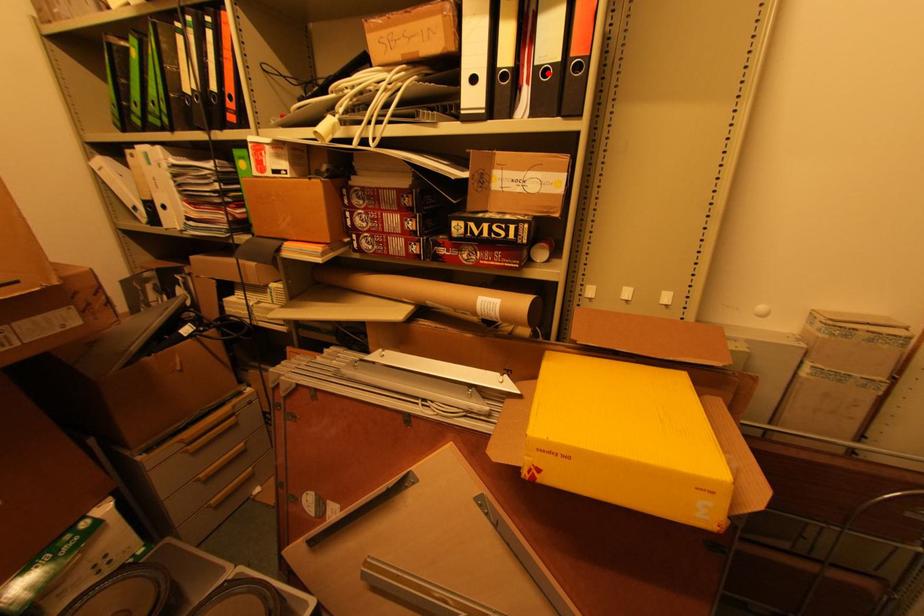
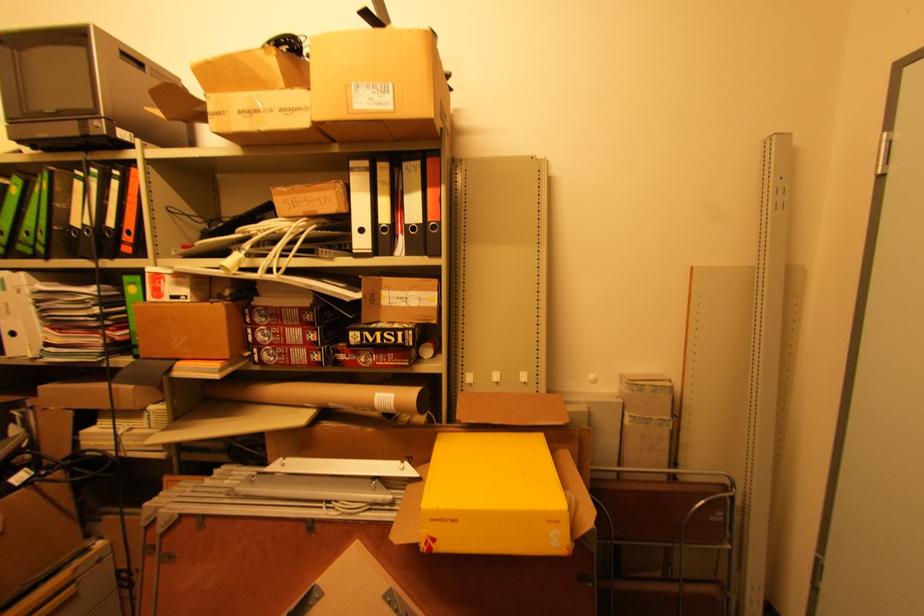
In the second image, find the point that corresponds to the highlighted location in the first image.

(417, 229)